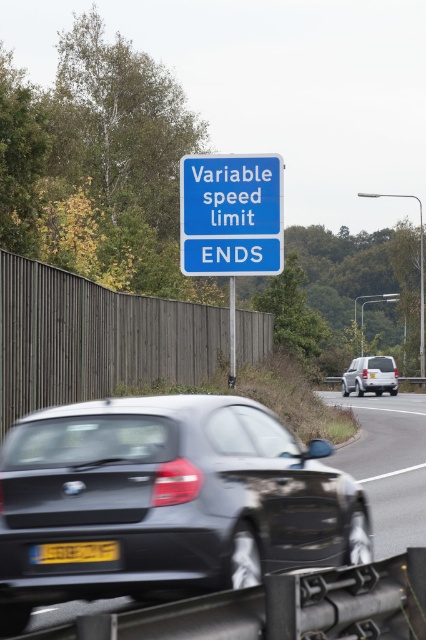
You are driving a matte black car at center and see a white matte suv at center ahead. According to the road sign, which direction should you move to stay in your lane?

The matte black car at center is to the left of white matte suv at center, so you should stay to the left to remain in your lane.

Based on the photo, you are standing at the position of the camera and want to reach point (391, 364). Which direction should you move relative to point (253, 250)?

You should move away from point (253, 250) because point (391, 364) is further from the camera compared to point (253, 250).

You are a pedestrian standing at the edge of the road near the blue plastic sign at upper center. You see the matte black car at center approaching. Based on their heights, which object is taller?

The blue plastic sign at upper center is taller than the matte black car at center.